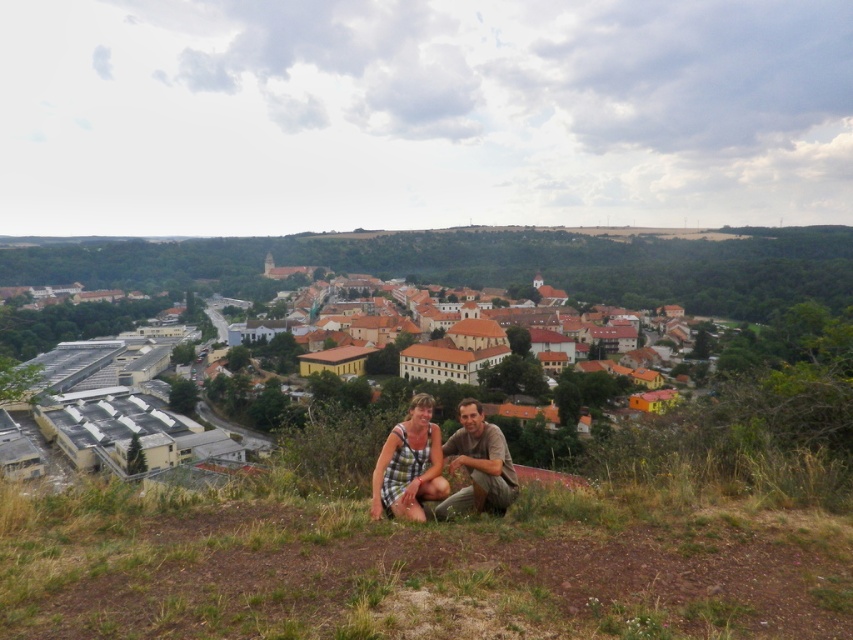
Does brown tiled roofs at center have a greater height compared to plaid fabric couple at center?

Indeed, brown tiled roofs at center has a greater height compared to plaid fabric couple at center.

The width and height of the screenshot is (853, 640). What are the coordinates of `brown tiled roofs at center` in the screenshot? It's located at (538, 442).